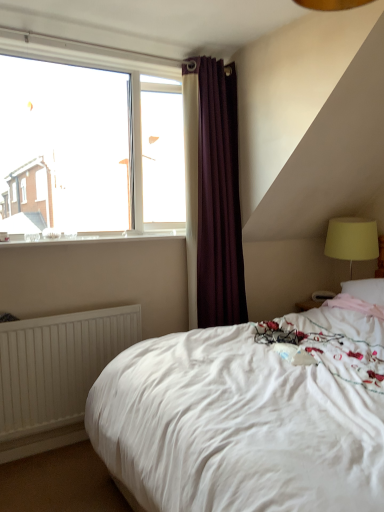
Question: Looking at their shapes, would you say clear glass window at upper left is wider or thinner than yellow fabric lampshade at right?

Choices:
 (A) thin
 (B) wide

Answer: (A)

Question: In the image, is clear glass window at upper left positioned in front of or behind yellow fabric lampshade at right?

Choices:
 (A) behind
 (B) front

Answer: (B)

Question: Considering the real-world distances, which object is farthest from the dark purple velvet curtain at upper center?

Choices:
 (A) white matte radiator at lower left
 (B) clear glass window at upper left
 (C) white soft bed at center
 (D) yellow fabric lampshade at right
 (E) white glossy window sill at upper left

Answer: (C)

Question: Which object is positioned closest to the white matte radiator at lower left?

Choices:
 (A) dark purple velvet curtain at upper center
 (B) white glossy window sill at upper left
 (C) white soft bed at center
 (D) clear glass window at upper left
 (E) yellow fabric lampshade at right

Answer: (B)